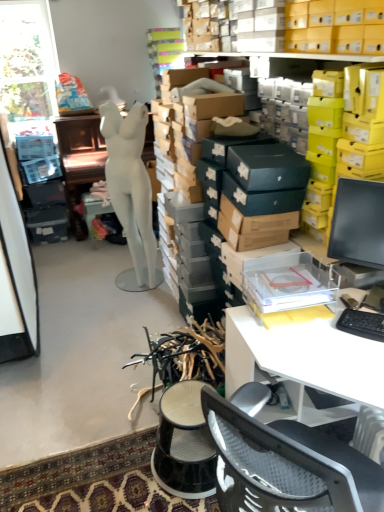
Locate an element on the screen. free location above white plastic desk at lower right (from a real-world perspective) is located at coordinates (335, 339).